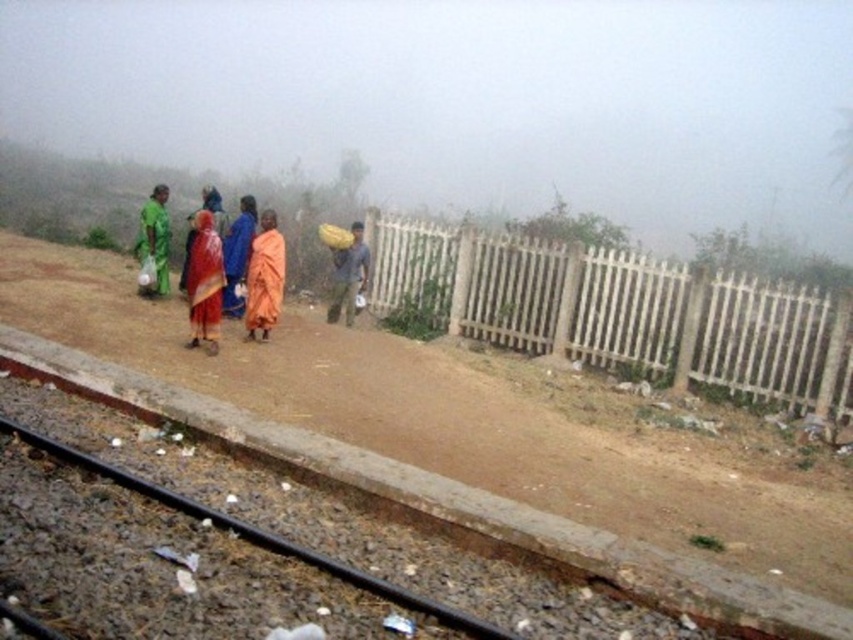
You are a traveler walking along the dirt path near the railway tracks. You see the black rubber track at lower left and the brown fabric bag at center. Which object takes up more space in the image?

The black rubber track at lower left is larger in size than the brown fabric bag at center, so it takes up more space in the image.